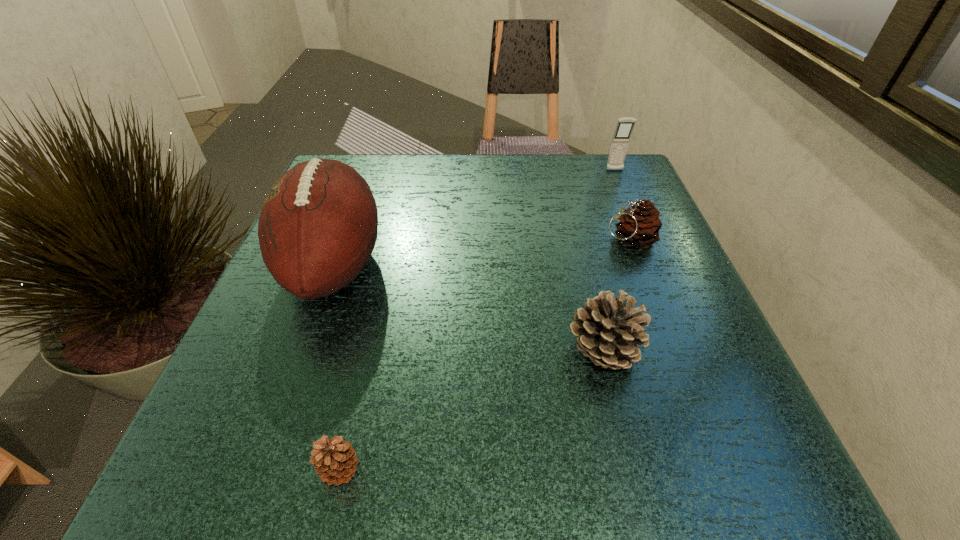
Find the location of a particular element. The width and height of the screenshot is (960, 540). the tallest object is located at coordinates (317, 229).

This screenshot has height=540, width=960. I want to click on cellular telephone, so click(x=621, y=138).

Identify the location of the tallest pinecone. Image resolution: width=960 pixels, height=540 pixels. (608, 330).

At what (x,y) coordinates should I click in order to perform the action: click on the second farthest pinecone. Please return your answer as a coordinate pair (x, y). Looking at the image, I should click on (608, 330).

Locate an element on the screen. The width and height of the screenshot is (960, 540). the second tallest pinecone is located at coordinates (639, 226).

Where is `the farthest pinecone`? The width and height of the screenshot is (960, 540). the farthest pinecone is located at coordinates (639, 226).

The image size is (960, 540). Find the location of `the leftmost pinecone`. the leftmost pinecone is located at coordinates (335, 460).

Find the location of a particular element. the shortest pinecone is located at coordinates (335, 460).

Where is `free space located 0.100m on the right of the tallest object`? The width and height of the screenshot is (960, 540). free space located 0.100m on the right of the tallest object is located at coordinates (438, 265).

Image resolution: width=960 pixels, height=540 pixels. In order to click on vacant space situated 0.210m on the front-facing side of the cellular telephone in this screenshot , I will do `click(637, 225)`.